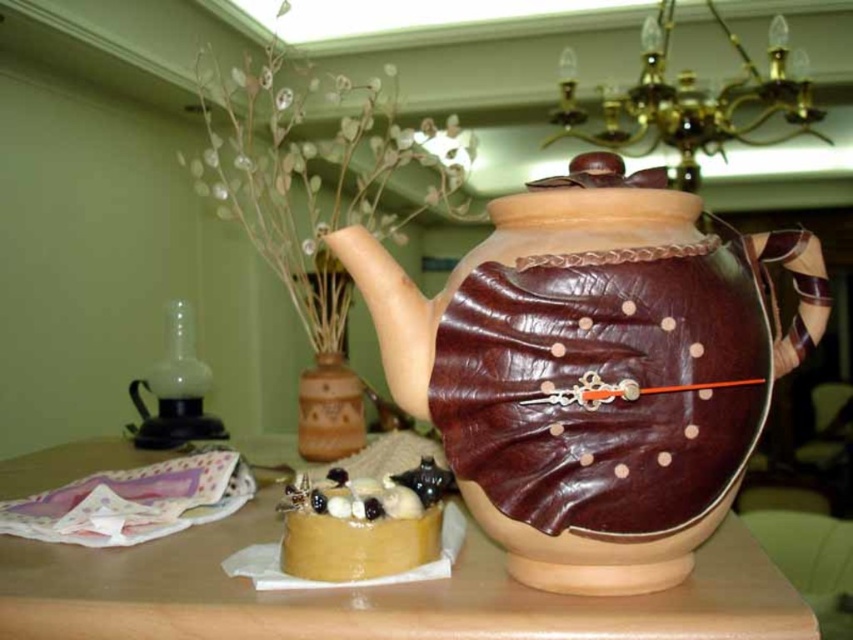
Question: Which object is closer to the camera taking this photo?

Choices:
 (A) wooden table at center
 (B) gold-bronze chandelier at upper center
 (C) beaded brown vase at center
 (D) smooth caramel cake at lower left

Answer: (A)

Question: Can you confirm if wooden table at center is positioned below beaded brown vase at center?

Choices:
 (A) no
 (B) yes

Answer: (B)

Question: Which point is farther from the camera taking this photo?

Choices:
 (A) (109, 548)
 (B) (791, 100)
 (C) (589, 180)
 (D) (312, 397)

Answer: (B)

Question: Among these objects, which one is farthest from the camera?

Choices:
 (A) gold-bronze chandelier at upper center
 (B) beaded brown vase at center
 (C) wooden table at center

Answer: (A)

Question: Does brown leather teapot at center lie behind gold-bronze chandelier at upper center?

Choices:
 (A) yes
 (B) no

Answer: (B)

Question: Does gold-bronze chandelier at upper center appear on the left side of smooth caramel cake at lower left?

Choices:
 (A) no
 (B) yes

Answer: (A)